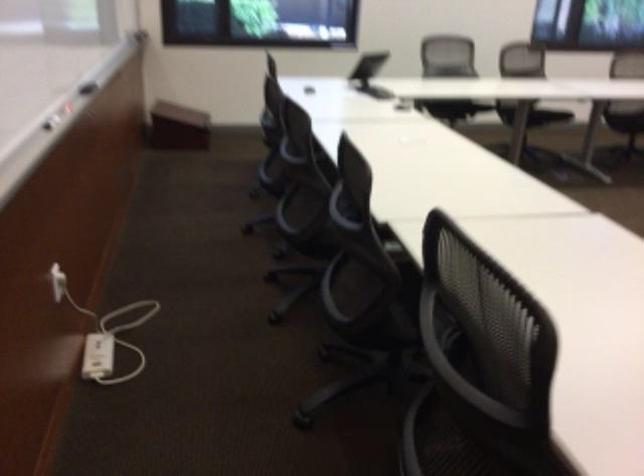
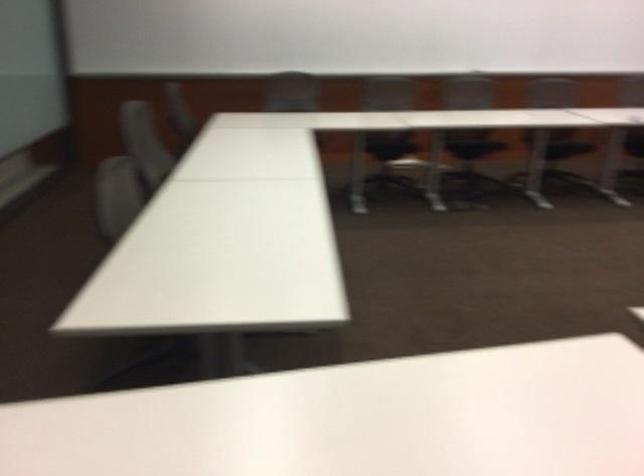
How did the camera likely rotate?

The camera's rotation is toward right-down.